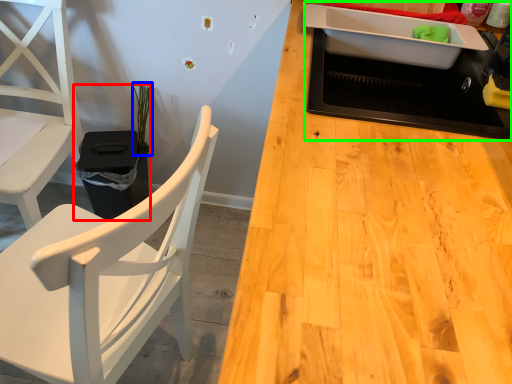
Question: Which is farther away from houseplant (highlighted by a red box)? plant (highlighted by a blue box) or appliance (highlighted by a green box)?

Choices:
 (A) plant
 (B) appliance

Answer: (B)